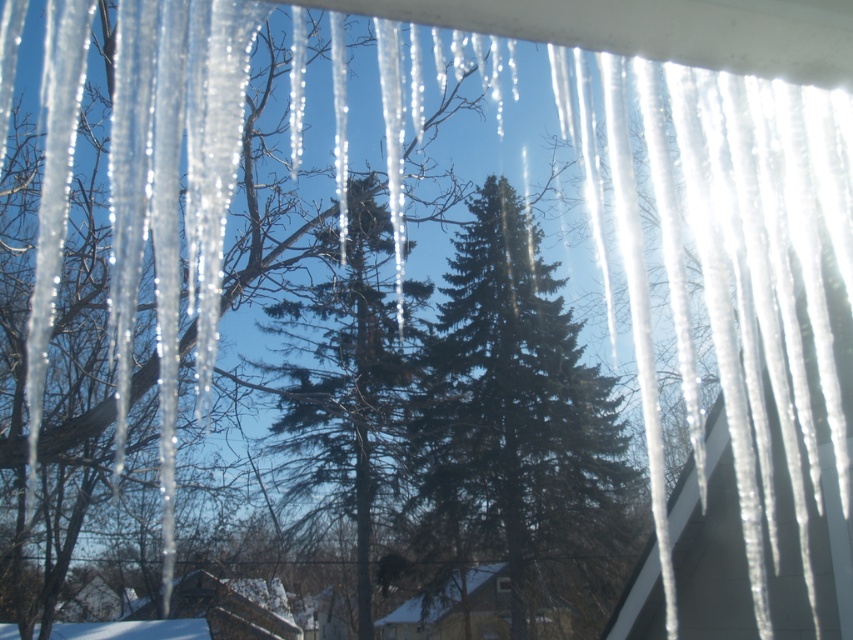
You are an arborist inspecting two trees in a winter landscape. You see the green matte evergreen tree at center and the green textured pine tree at center. Which tree would you need to climb higher to reach the top?

The green textured pine tree at center is larger in size compared to the green matte evergreen tree at center, so you would need to climb higher to reach its top.

You are standing at the base of the roof where the icicles hang. You notice two points marked on the icicles. Which point is closer to you, point at position (337, 465) or point at position (506, 577)?

Point at position (337, 465) is closer to you because it is in front of point at position (506, 577).